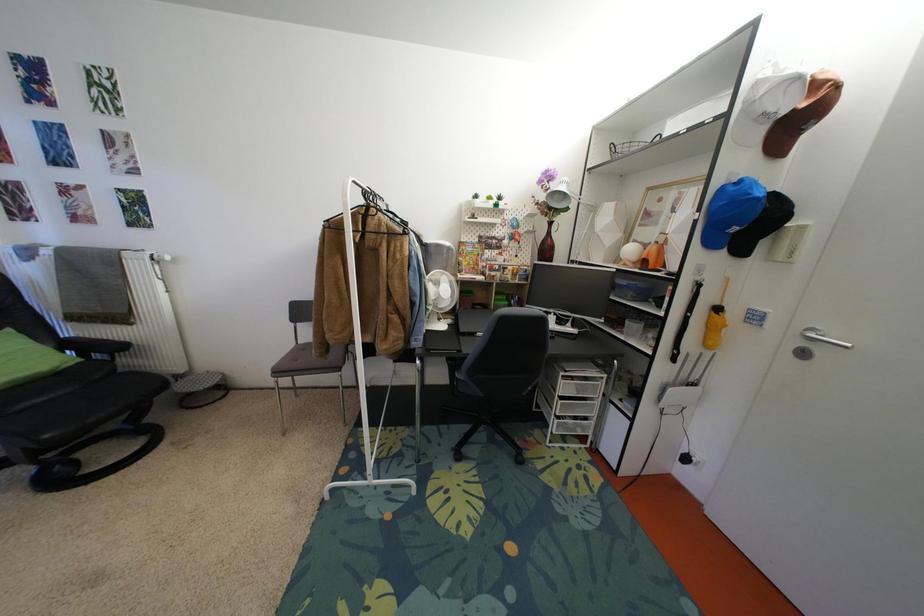
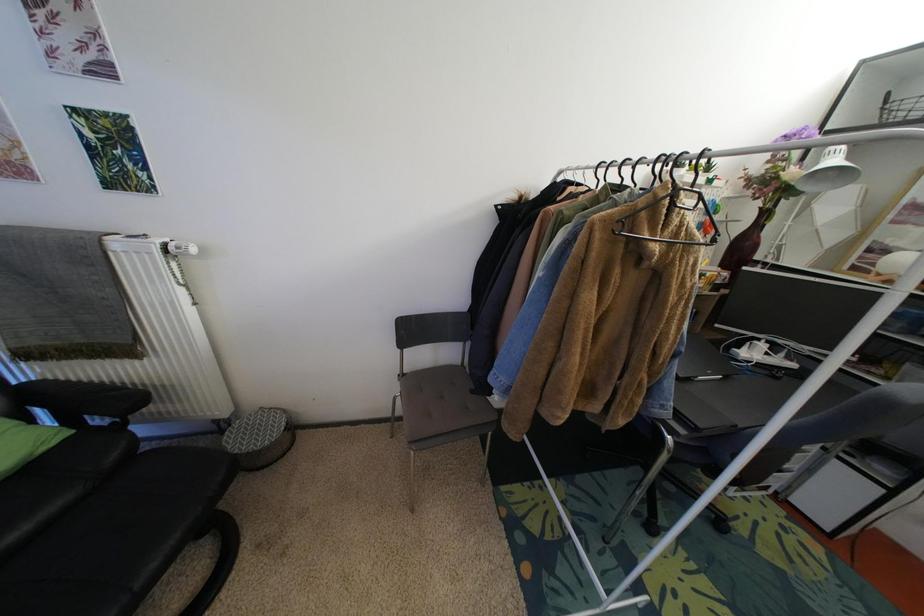
What movement of the cameraman would produce the second image?

The cameraman walked toward left, forward.